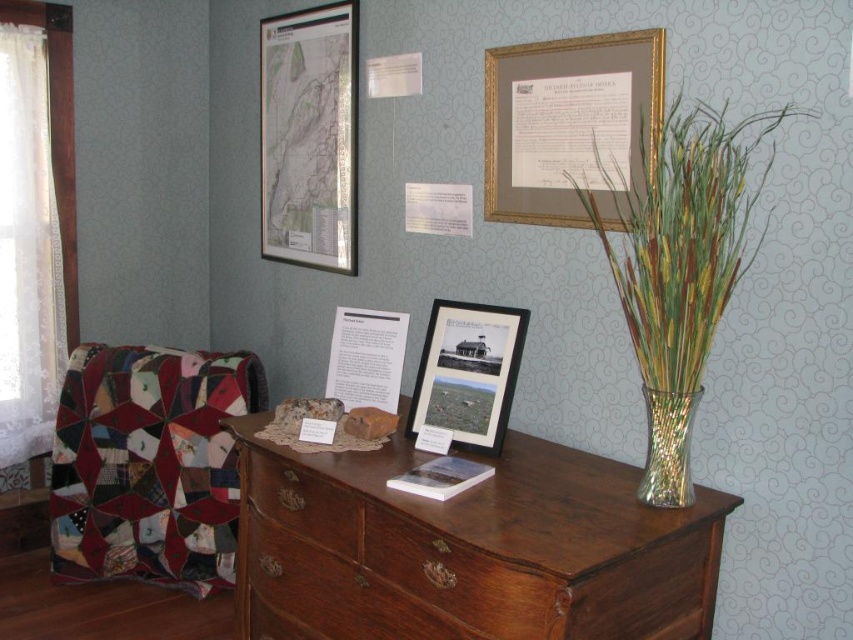
You are standing in front of the dresser and want to reach both points on the dresser surface. Which point, point (686, 531) or point (577, 173), is closer to you?

Point (686, 531) is closer to you than point (577, 173).

You are standing in front of the dresser and want to place a new decorative item exactly where the metallic vase at right is currently located. According to the scene description, where should you place it?

The metallic vase at right should be placed at the 2D coordinates point (680, 266) on the dresser.

You are organizing a historical exhibit and need to determine which object can better accommodate a large display label. Based on the scene, which object between the matte paper map at upper left and the brown wood drawer at center has more space for a label?

The matte paper map at upper left has a larger size compared to the brown wood drawer at center, so it can accommodate a larger display label.